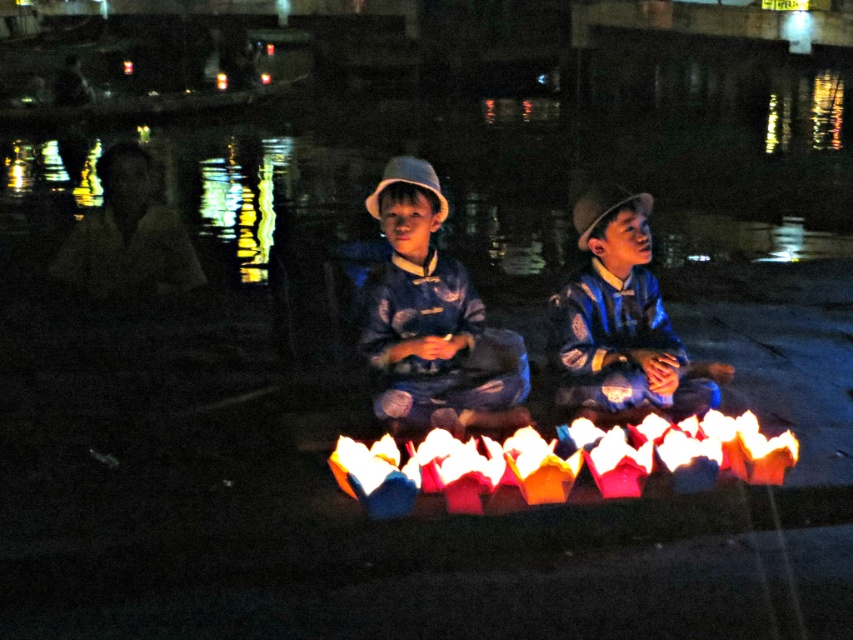
Question: Which point is closer to the camera?

Choices:
 (A) (657, 429)
 (B) (619, 371)
 (C) (375, 340)

Answer: (A)

Question: Among these objects, which one is nearest to the camera?

Choices:
 (A) multicolored paper lanterns at center
 (B) matte blue fabric at center

Answer: (A)

Question: Does matte blue fabric at center appear on the left side of multicolored paper lanterns at center?

Choices:
 (A) yes
 (B) no

Answer: (A)

Question: Does multicolored paper lanterns at center lie in front of blue striped shirt at center?

Choices:
 (A) no
 (B) yes

Answer: (B)

Question: Is matte blue fabric at center positioned at the back of multicolored paper lanterns at center?

Choices:
 (A) no
 (B) yes

Answer: (B)

Question: Which point is farther to the camera?

Choices:
 (A) (573, 317)
 (B) (442, 275)
 (C) (612, 456)

Answer: (A)